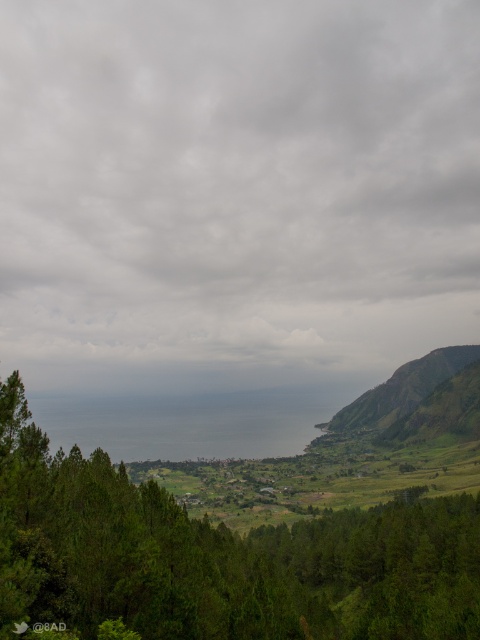
Question: Considering the relative positions of cloudy sky at upper center and green leafy trees at lower left in the image provided, where is cloudy sky at upper center located with respect to green leafy trees at lower left?

Choices:
 (A) left
 (B) right

Answer: (A)

Question: Among these points, which one is farthest from the camera?

Choices:
 (A) (19, 445)
 (B) (283, 161)

Answer: (B)

Question: Does cloudy sky at upper center appear on the right side of green leafy trees at lower left?

Choices:
 (A) no
 (B) yes

Answer: (A)

Question: In this image, where is cloudy sky at upper center located relative to green leafy trees at lower left?

Choices:
 (A) right
 (B) left

Answer: (B)

Question: Among these objects, which one is farthest from the camera?

Choices:
 (A) cloudy sky at upper center
 (B) green leafy trees at lower left

Answer: (A)

Question: Which point is farther from the camera taking this photo?

Choices:
 (A) (135, 192)
 (B) (309, 545)

Answer: (A)